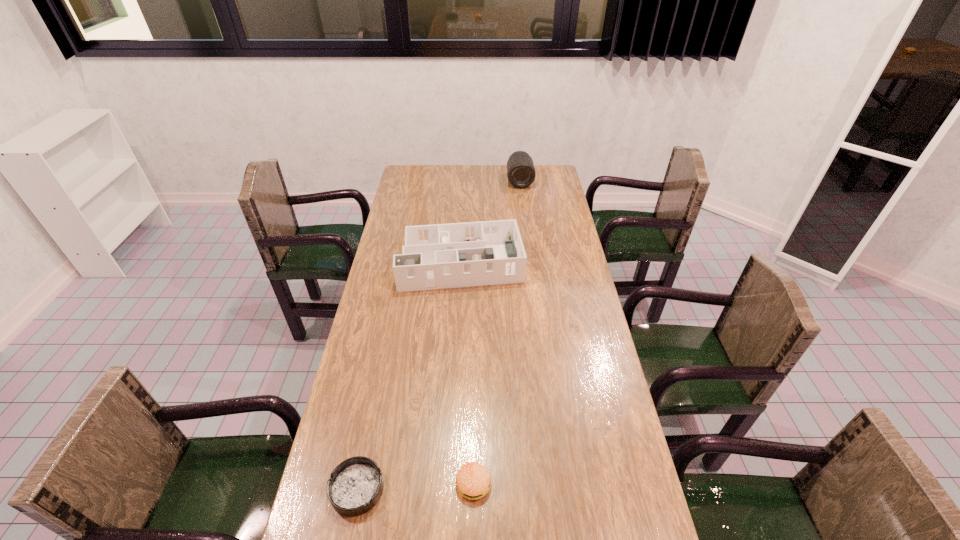
Find the location of `ashtray that is at the left edge`. ashtray that is at the left edge is located at coordinates (355, 486).

The image size is (960, 540). In order to click on object positioned at the right edge in this screenshot , I will do `click(521, 173)`.

Locate an element on the screen. object at the far right corner is located at coordinates (521, 173).

Where is `blank space at the far edge of the desktop`? blank space at the far edge of the desktop is located at coordinates (466, 167).

Find the location of a particular element. vacant space at the left edge of the desktop is located at coordinates (386, 281).

In the image, there is a desktop. At what (x,y) coordinates should I click in order to perform the action: click on vacant space at the right edge. Please return your answer as a coordinate pair (x, y). The width and height of the screenshot is (960, 540). Looking at the image, I should click on (577, 306).

Identify the location of vacant space at the far left corner of the desktop. This screenshot has height=540, width=960. (420, 177).

This screenshot has height=540, width=960. What are the coordinates of `free space between the shortest object and the third nearest object` in the screenshot? It's located at (409, 375).

The height and width of the screenshot is (540, 960). Find the location of `free spot between the shortest object and the farthest object`. free spot between the shortest object and the farthest object is located at coordinates (439, 335).

You are a GUI agent. You are given a task and a screenshot of the screen. Output one action in this format:
    pyautogui.click(x=<x>, y=<y>)
    Task: Click on the empty location between the dollhouse and the farthest object
    This screenshot has height=540, width=960.
    Given the screenshot: What is the action you would take?
    pyautogui.click(x=491, y=221)